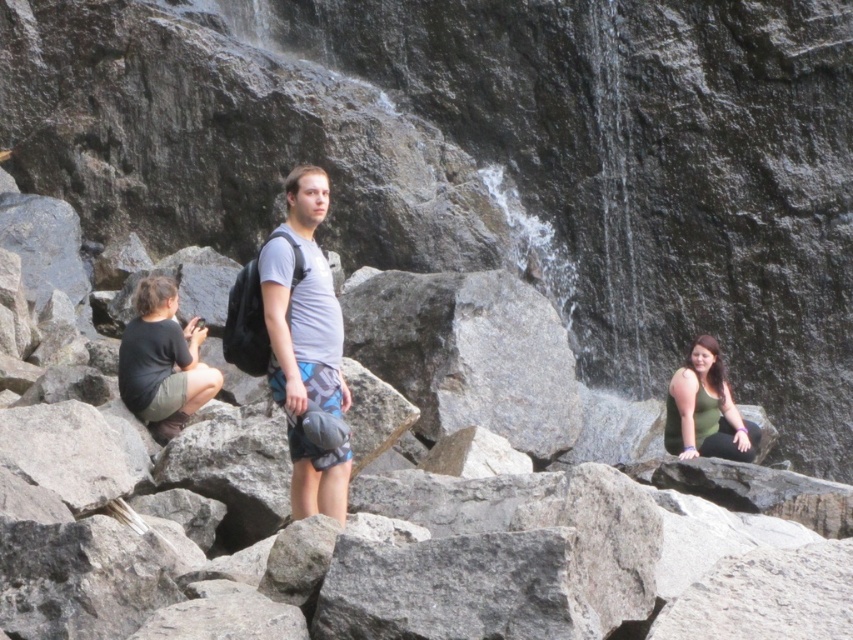
This screenshot has height=640, width=853. I want to click on gray fabric backpack at center, so click(306, 344).

Is point (306, 323) in front of point (703, 401)?

Yes, point (306, 323) is in front of point (703, 401).

Is point (293, 188) farther from camera compared to point (695, 429)?

No, (293, 188) is in front of (695, 429).

This screenshot has width=853, height=640. Find the location of `gray fabric backpack at center`. gray fabric backpack at center is located at coordinates (306, 344).

Locate an element on the screen. black fabric at left is located at coordinates (163, 362).

Who is more distant from viewer, [206,336] or [697,403]?

Point [697,403]

The image size is (853, 640). Identify the location of black fabric at left. (163, 362).

Can you confirm if gray fabric backpack at center is smaller than black fabric at left?

Incorrect, gray fabric backpack at center is not smaller in size than black fabric at left.

Does point (280, 248) come closer to viewer compared to point (194, 332)?

Yes.

Image resolution: width=853 pixels, height=640 pixels. I want to click on gray fabric backpack at center, so click(x=306, y=344).